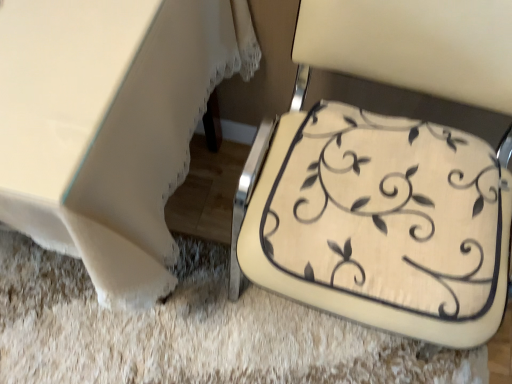
Describe the element at coordinates (109, 125) in the screenshot. The width and height of the screenshot is (512, 384). I see `white fabric table at lower left` at that location.

Where is `white fabric table at lower left`? The width and height of the screenshot is (512, 384). white fabric table at lower left is located at coordinates tap(109, 125).

What is the approximate width of white fabric table at lower left?

The width of white fabric table at lower left is 26.43 inches.

Measure the distance between point (341, 186) and camera.

Point (341, 186) is 30.47 inches from camera.

Find the location of `beige fabric cushion at lower right`. beige fabric cushion at lower right is located at coordinates (388, 175).

What do you see at coordinates (388, 175) in the screenshot? This screenshot has width=512, height=384. I see `beige fabric cushion at lower right` at bounding box center [388, 175].

Image resolution: width=512 pixels, height=384 pixels. Find the location of `white fabric table at lower left`. white fabric table at lower left is located at coordinates (109, 125).

Between beige fabric cushion at lower right and white fabric table at lower left, which one appears on the right side from the viewer's perspective?

From the viewer's perspective, beige fabric cushion at lower right appears more on the right side.

Which object is more forward, beige fabric cushion at lower right or white fabric table at lower left?

beige fabric cushion at lower right is more forward.

Between point (353, 205) and point (7, 8), which one is positioned in front?

The point (7, 8) is closer.

Consider the image. From the image's perspective, is beige fabric cushion at lower right below white fabric table at lower left?

Indeed, from the image's perspective, beige fabric cushion at lower right is shown beneath white fabric table at lower left.

From a real-world perspective, is beige fabric cushion at lower right located higher than white fabric table at lower left?

Yes, from a real-world perspective, beige fabric cushion at lower right is above white fabric table at lower left.

Considering the relative sizes of beige fabric cushion at lower right and white fabric table at lower left in the image provided, is beige fabric cushion at lower right thinner than white fabric table at lower left?

Correct, the width of beige fabric cushion at lower right is less than that of white fabric table at lower left.

Does beige fabric cushion at lower right have a greater height compared to white fabric table at lower left?

Correct, beige fabric cushion at lower right is much taller as white fabric table at lower left.

Considering the sizes of beige fabric cushion at lower right and white fabric table at lower left in the image, is beige fabric cushion at lower right bigger or smaller than white fabric table at lower left?

Clearly, beige fabric cushion at lower right is smaller in size than white fabric table at lower left.

Is beige fabric cushion at lower right situated inside white fabric table at lower left or outside?

The correct answer is: outside.

Is there a large distance between beige fabric cushion at lower right and white fabric table at lower left?

beige fabric cushion at lower right is actually quite close to white fabric table at lower left.

Is beige fabric cushion at lower right facing towards white fabric table at lower left?

No, beige fabric cushion at lower right is not oriented towards white fabric table at lower left.

Where is `chair in front of the white fabric table at lower left`? The height and width of the screenshot is (384, 512). chair in front of the white fabric table at lower left is located at coordinates (388, 175).

From the picture: Considering the relative positions of white fabric table at lower left and beige fabric cushion at lower right in the image provided, is white fabric table at lower left to the left of beige fabric cushion at lower right from the viewer's perspective?

Yes.

Is white fabric table at lower left positioned behind beige fabric cushion at lower right?

Yes, white fabric table at lower left is further from the viewer.

Is point (188, 135) positioned before point (398, 141)?

No.

From the image's perspective, is white fabric table at lower left over beige fabric cushion at lower right?

Yes, from the image's perspective, white fabric table at lower left is over beige fabric cushion at lower right.

From a real-world perspective, is white fabric table at lower left over beige fabric cushion at lower right?

No.

Considering the relative sizes of white fabric table at lower left and beige fabric cushion at lower right in the image provided, is white fabric table at lower left wider than beige fabric cushion at lower right?

Correct, the width of white fabric table at lower left exceeds that of beige fabric cushion at lower right.

From their relative heights in the image, would you say white fabric table at lower left is taller or shorter than beige fabric cushion at lower right?

Considering their sizes, white fabric table at lower left has less height than beige fabric cushion at lower right.

Between white fabric table at lower left and beige fabric cushion at lower right, which one has larger size?

Bigger between the two is white fabric table at lower left.

From the picture: Can we say white fabric table at lower left lies outside beige fabric cushion at lower right?

Yes.

Is white fabric table at lower left next to beige fabric cushion at lower right and touching it?

No.

Is white fabric table at lower left oriented away from beige fabric cushion at lower right?

white fabric table at lower left does not have its back to beige fabric cushion at lower right.

How many degrees apart are the facing directions of white fabric table at lower left and beige fabric cushion at lower right?

The angle between the facing direction of white fabric table at lower left and the facing direction of beige fabric cushion at lower right is 2.11 degrees.

The image size is (512, 384). In order to click on chair that appears on the right of white fabric table at lower left in this screenshot , I will do `click(388, 175)`.

At what (x,y) coordinates should I click in order to perform the action: click on table above the beige fabric cushion at lower right (from the image's perspective). Please return your answer as a coordinate pair (x, y). This screenshot has width=512, height=384. Looking at the image, I should click on click(x=109, y=125).

This screenshot has height=384, width=512. Find the location of `table on the left of beige fabric cushion at lower right`. table on the left of beige fabric cushion at lower right is located at coordinates (109, 125).